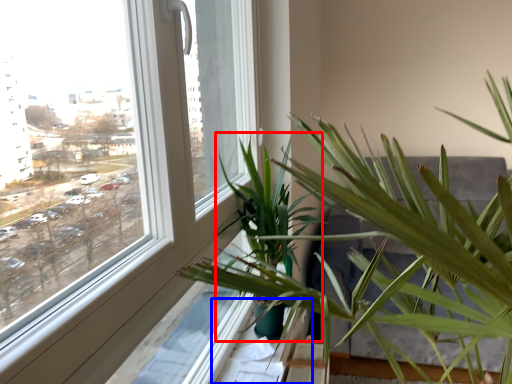
Question: Which of the following is the farthest to the observer, palm tree (highlighted by a red box) or window sill (highlighted by a blue box)?

Choices:
 (A) palm tree
 (B) window sill

Answer: (B)